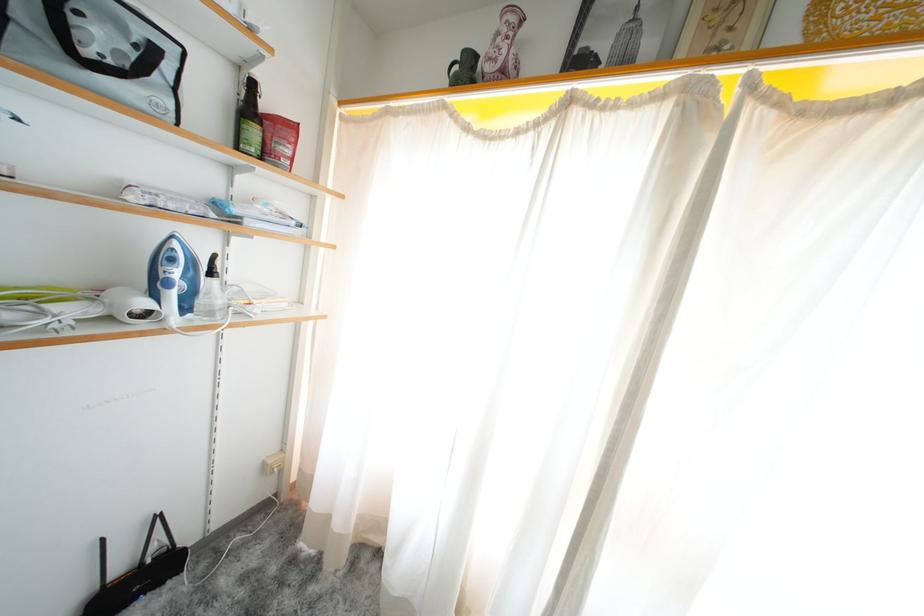
Find where to grasp the white hairdryer. Please return your answer as a coordinate pair (x, y).

(175, 272)